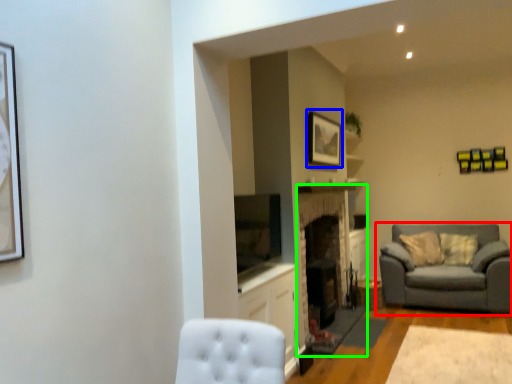
Question: Based on their relative distances, which object is farther from studio couch (highlighted by a red box)? Choose from picture frame (highlighted by a blue box) and fireplace (highlighted by a green box).

Choices:
 (A) picture frame
 (B) fireplace

Answer: (A)